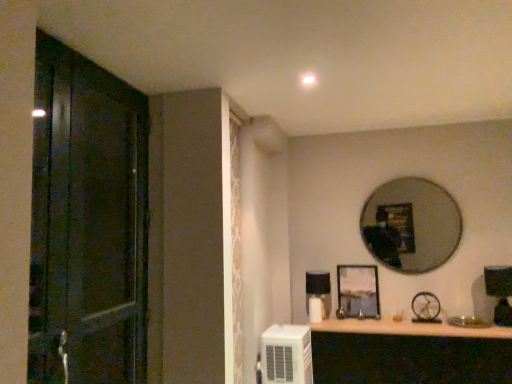
The height and width of the screenshot is (384, 512). I want to click on free space behind metallic silver clock at upper right, so click(420, 320).